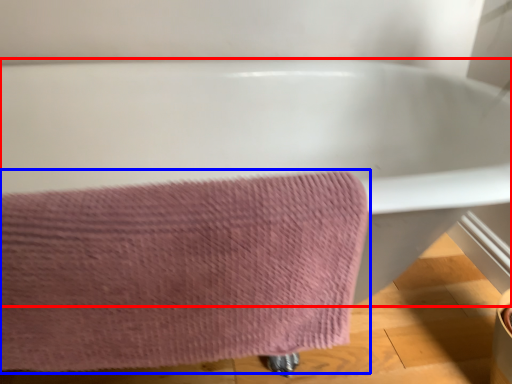
Question: Among these objects, which one is nearest to the camera, bathtub (highlighted by a red box) or towel (highlighted by a blue box)?

Choices:
 (A) bathtub
 (B) towel

Answer: (A)